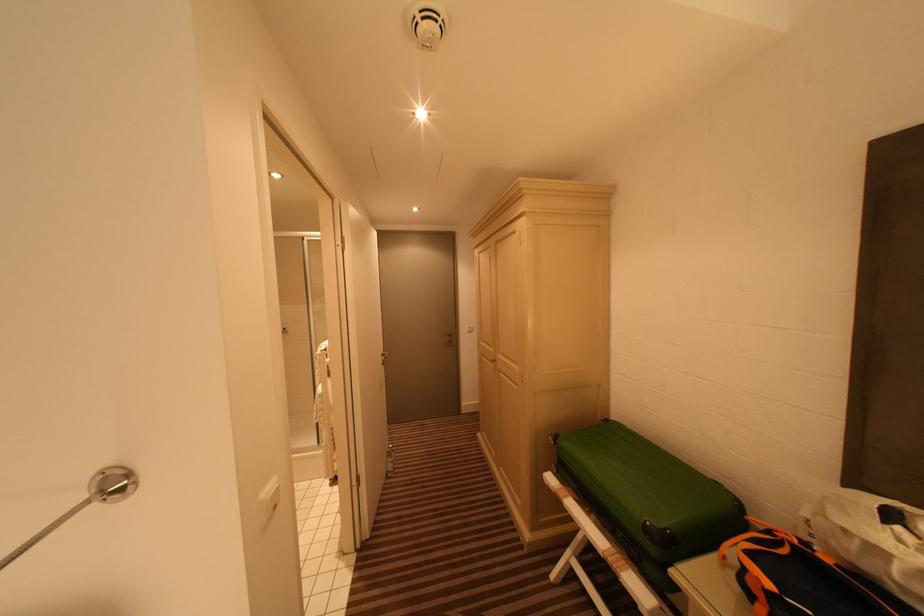
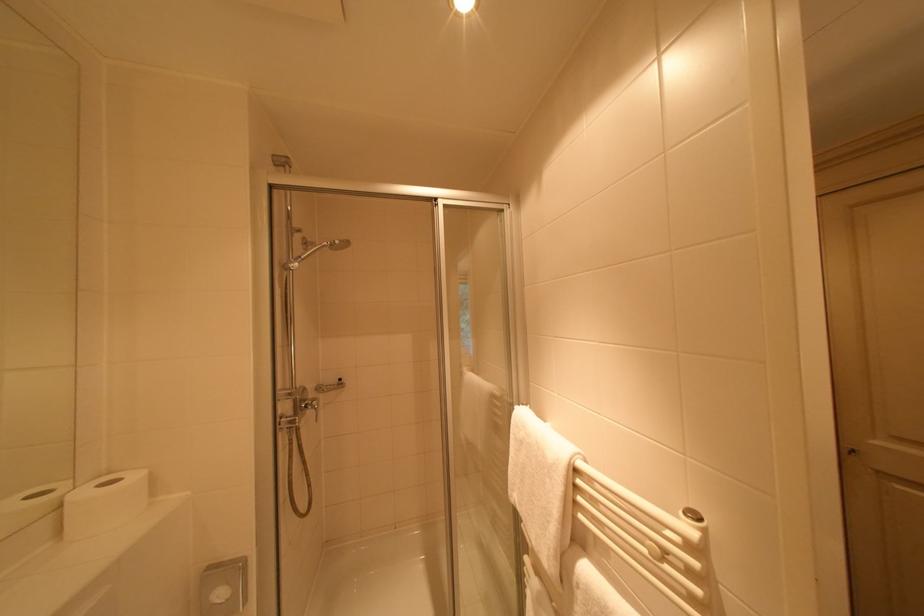
Which direction would the cameraman need to move to produce the second image?

The movement direction of the cameraman is left, forward.